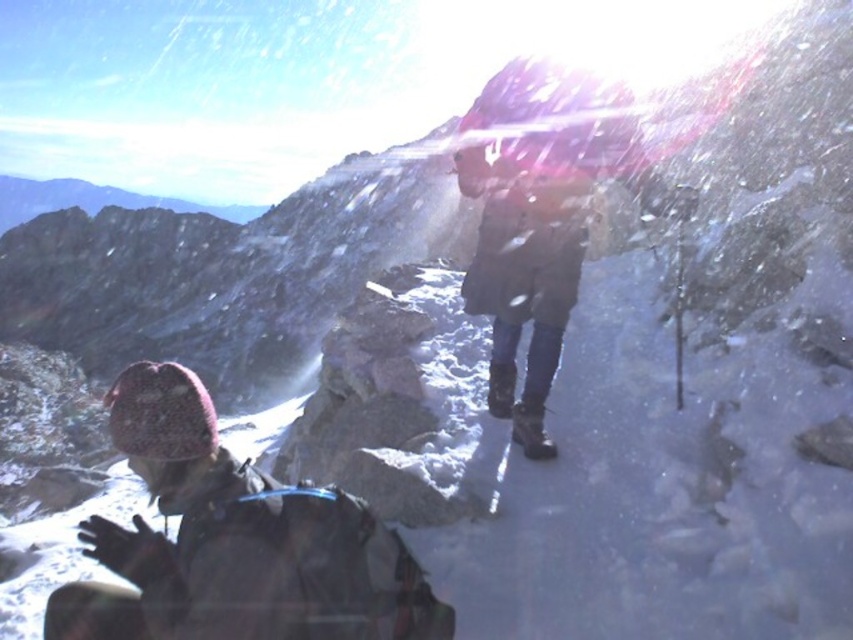
You are a photographer trying to capture a clear shot of both the dark gray wool hat at lower left and the brown leather jacket at center. However, the lens flare in the upper right corner is causing some glare. Based on their positions, which object is closer to the camera and might block the other from view?

The dark gray wool hat at lower left is below the brown leather jacket at center, so the brown leather jacket at center is closer to the camera and might block the dark gray wool hat at lower left from view.

You are standing at the point with coordinates point (335, 572) and want to walk towards the point with coordinates point (541, 378). Since you are in a snowy mountain area, will you have to walk uphill or downhill?

Point (335, 572) is in front of point (541, 378), so you will have to walk uphill because being in front in a mountain scene typically indicates a higher elevation.

You are standing in the snowy mountain scene and want to locate the dark gray wool hat at lower left. According to the coordinates provided, where exactly should you look to find it?

The dark gray wool hat at lower left is located at point 0.848 on the x axis and 0.275 on the y axis.